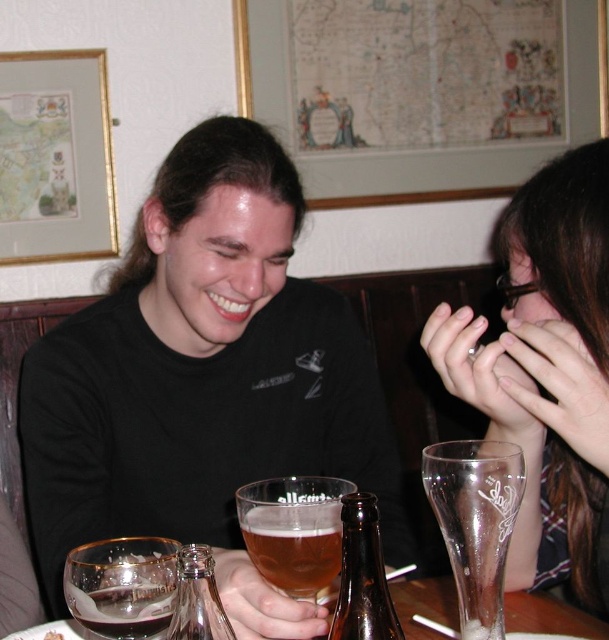
You are a photographer trying to capture a candid shot of the two people at the table. You want to ensure that both the black matte shirt at center and the translucent glass beer at center are clearly visible in the photo. Given their sizes, which object should you focus on to ensure proper focus and clarity?

The black matte shirt at center has a larger size compared to the translucent glass beer at center, so focusing on the larger object, the black matte shirt at center, will ensure proper focus and clarity for both items in the photo.

You are a photographer standing at a distance of 20 inches from the table. You want to take a photo of the clear glass beer glass at right. Can you reach it without moving your position?

The clear glass beer glass at right is 19.14 inches away from the camera, so yes, you can reach it without moving your position since your distance is 20 inches which is farther than the glass.